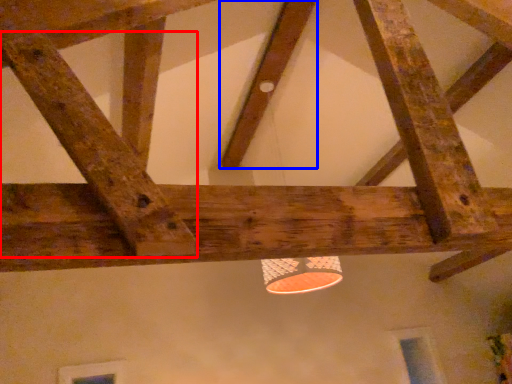
Question: Which object is closer to the camera taking this photo, plank (highlighted by a red box) or plank (highlighted by a blue box)?

Choices:
 (A) plank
 (B) plank

Answer: (A)